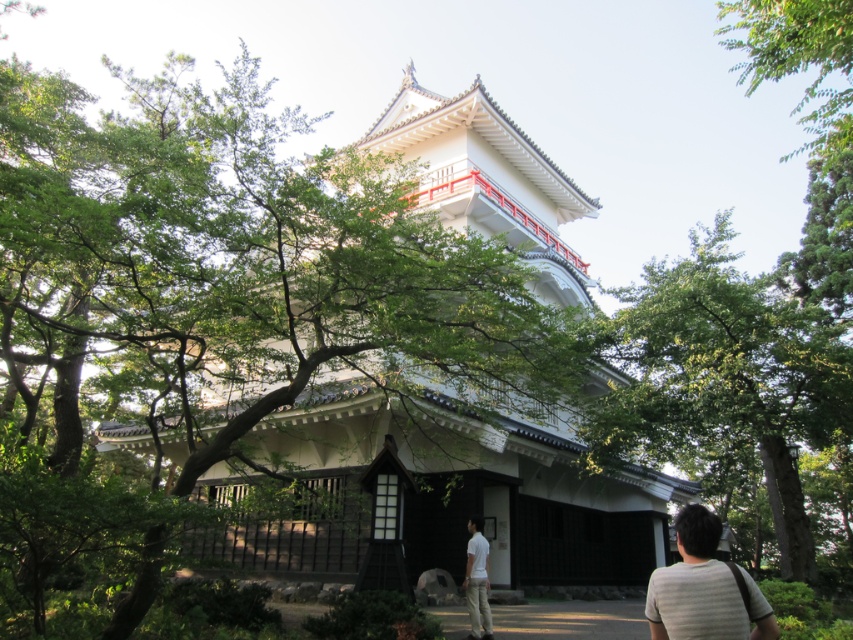
Can you confirm if green leafy tree at center is shorter than white cotton shirt at lower center?

Incorrect, green leafy tree at center's height does not fall short of white cotton shirt at lower center's.

Locate an element on the screen. The image size is (853, 640). green leafy tree at center is located at coordinates (728, 378).

Is point (849, 420) farther from viewer compared to point (477, 516)?

No, (849, 420) is in front of (477, 516).

Locate an element on the screen. The width and height of the screenshot is (853, 640). green leafy tree at center is located at coordinates (728, 378).

Is point (492, 452) behind point (781, 486)?

Yes, point (492, 452) is farther from viewer.

Is point (624, 556) closer to viewer compared to point (722, 506)?

Yes.

This screenshot has width=853, height=640. Identify the location of white wooden pagoda at center. (x=486, y=480).

Is striped cotton shirt at lower right taller than white cotton shirt at lower center?

Correct, striped cotton shirt at lower right is much taller as white cotton shirt at lower center.

Measure the distance between striped cotton shirt at lower right and camera.

striped cotton shirt at lower right is 8.67 meters from camera.

Does point (682, 604) come in front of point (479, 586)?

Yes, it is in front of point (479, 586).

Where is `striped cotton shirt at lower right`? Image resolution: width=853 pixels, height=640 pixels. striped cotton shirt at lower right is located at coordinates (701, 588).